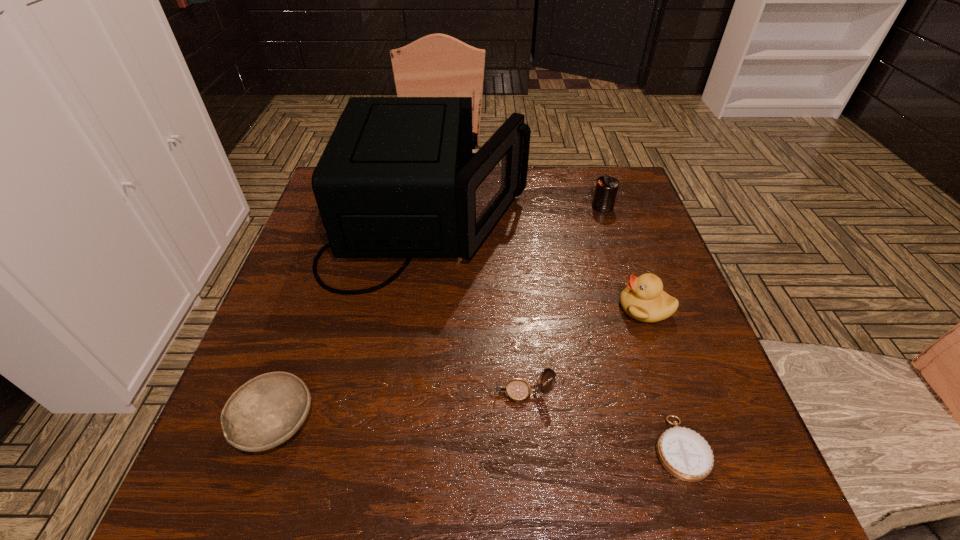
Find the location of a particular element. Image resolution: width=960 pixels, height=540 pixels. vacant region that satisfies the following two spatial constraints: 1. on the beak of the duckling; 2. on the front side of the bowl is located at coordinates (684, 423).

I want to click on free space that satisfies the following two spatial constraints: 1. on the back side of the can; 2. on the left side of the bowl, so click(351, 206).

I want to click on vacant area that satisfies the following two spatial constraints: 1. on the face of the taller compass; 2. on the front side of the bowl, so click(x=525, y=423).